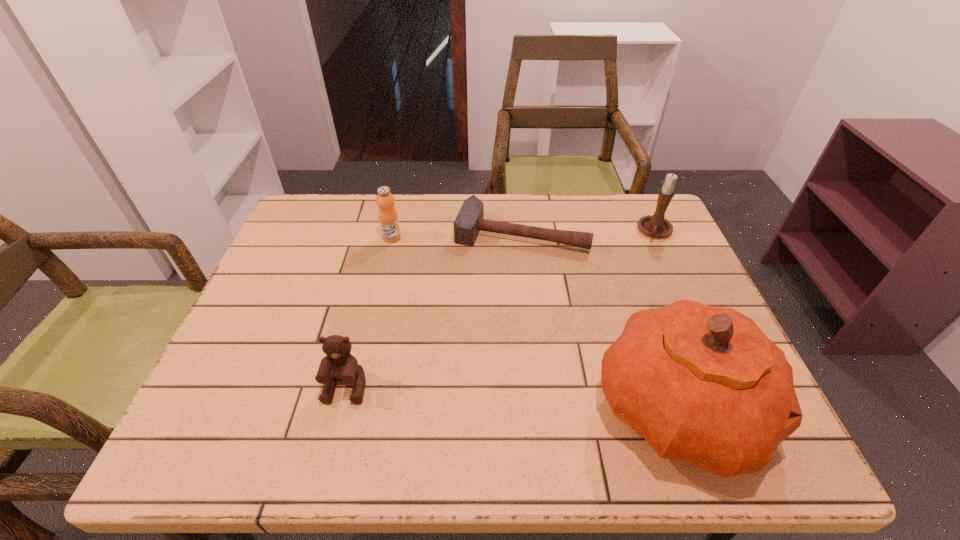
Locate an element on the screen. Image resolution: width=960 pixels, height=540 pixels. vacant area that lies between the orange juice and the teddy bear is located at coordinates (370, 312).

At what (x,y) coordinates should I click in order to perform the action: click on free space between the teddy bear and the hammer. Please return your answer as a coordinate pair (x, y). The image size is (960, 540). Looking at the image, I should click on (434, 310).

Locate an element on the screen. vacant region between the candle holder and the second shortest object is located at coordinates (501, 309).

Locate an element on the screen. This screenshot has width=960, height=540. free space between the hammer and the pumpkin is located at coordinates (600, 321).

Locate an element on the screen. Image resolution: width=960 pixels, height=540 pixels. unoccupied area between the shortest object and the fourth tallest object is located at coordinates (434, 310).

Locate an element on the screen. free space between the teddy bear and the orange juice is located at coordinates (370, 312).

Find the location of `object that ranks as the third closest to the candle holder`. object that ranks as the third closest to the candle holder is located at coordinates click(x=388, y=218).

You are a GUI agent. You are given a task and a screenshot of the screen. Output one action in this format:
    pyautogui.click(x=<x>, y=<y>)
    Task: Click on the object that is the second closest one to the third tallest object
    Image resolution: width=960 pixels, height=540 pixels.
    Given the screenshot: What is the action you would take?
    339,365

Locate an element on the screen. This screenshot has height=540, width=960. vacant position in the image that satisfies the following two spatial constraints: 1. on the back side of the candle holder; 2. on the left side of the third tallest object is located at coordinates (394, 232).

Find the location of a particular element. Image resolution: width=960 pixels, height=540 pixels. vacant position in the image that satisfies the following two spatial constraints: 1. on the face of the fourth tallest object; 2. on the front-facing side of the tallest object is located at coordinates (341, 408).